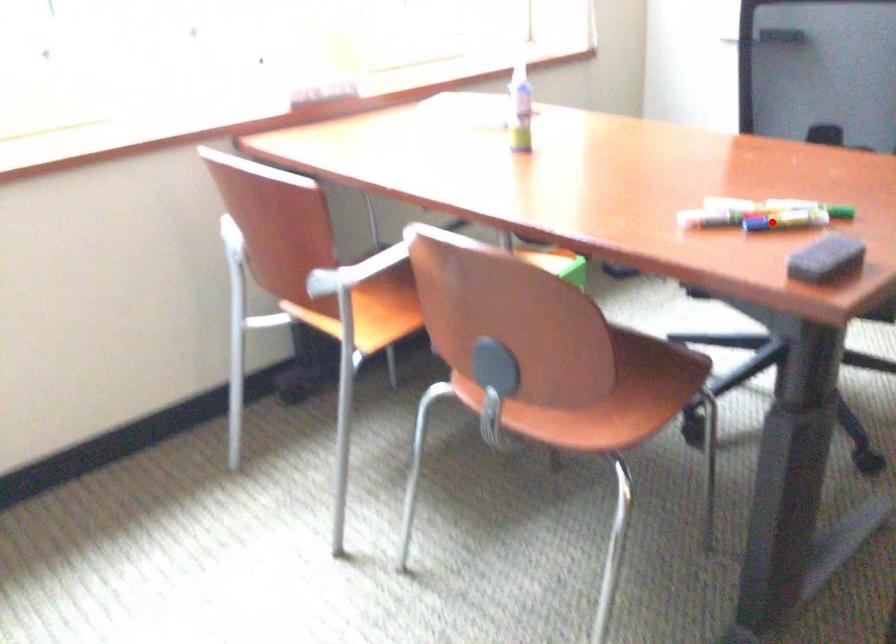
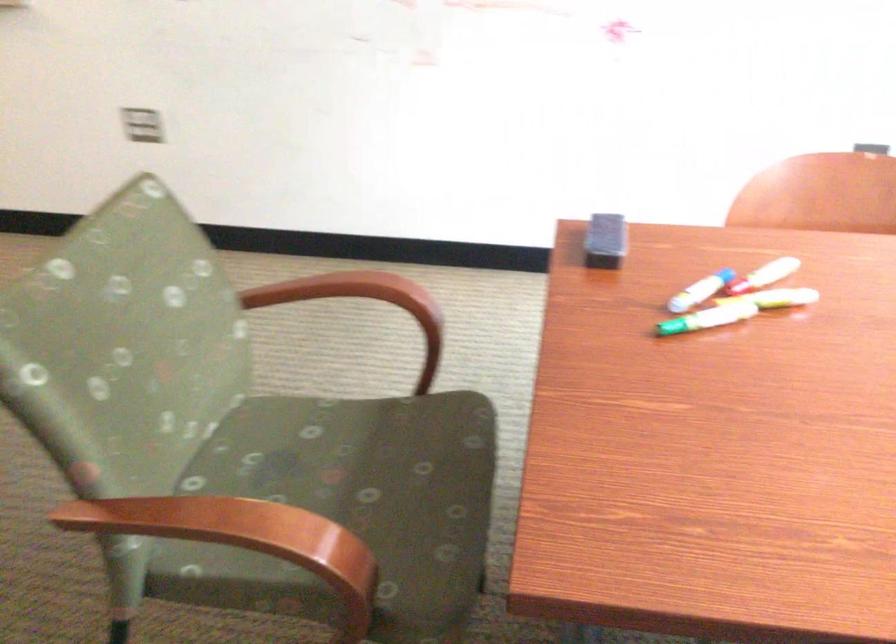
The point at the highlighted location is marked in the first image. Where is the corresponding point in the second image?

(700, 290)